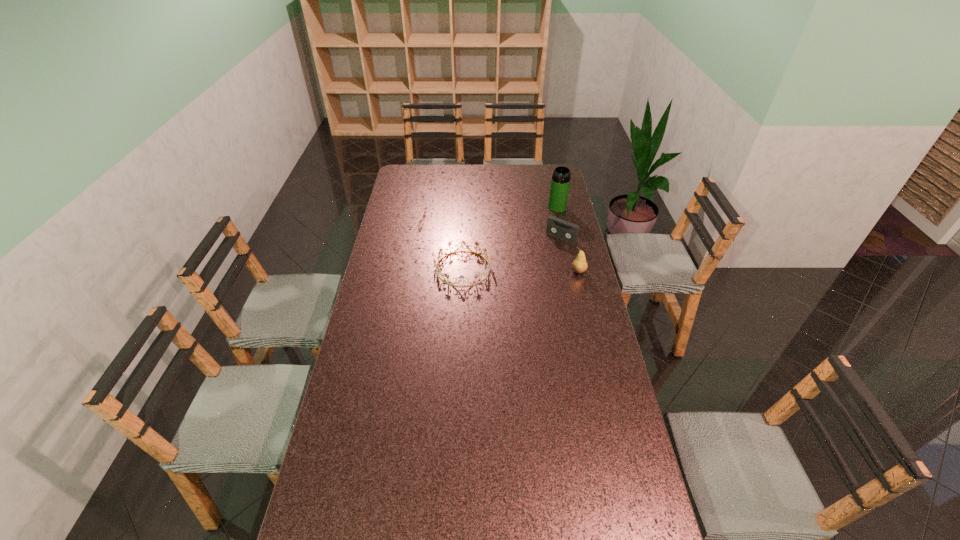
Find the location of a particular element. The height and width of the screenshot is (540, 960). free space at the far left corner of the desktop is located at coordinates (411, 174).

Locate an element on the screen. The image size is (960, 540). free space that is in between the third nearest object and the pear is located at coordinates (570, 254).

Where is `empty space that is in between the pear and the tiara`? Image resolution: width=960 pixels, height=540 pixels. empty space that is in between the pear and the tiara is located at coordinates (521, 270).

Identify the location of vacant area that lies between the tiara and the tallest object. This screenshot has height=540, width=960. (511, 238).

You are a GUI agent. You are given a task and a screenshot of the screen. Output one action in this format:
    pyautogui.click(x=<x>, y=<y>)
    Task: Click on the free space that is in between the second farthest object and the tiara
    Image resolution: width=960 pixels, height=540 pixels.
    Given the screenshot: What is the action you would take?
    pyautogui.click(x=513, y=253)

Where is `free space between the pear and the leftmost object`? The height and width of the screenshot is (540, 960). free space between the pear and the leftmost object is located at coordinates (521, 270).

Locate an element on the screen. This screenshot has width=960, height=540. blank region between the leftmost object and the videotape is located at coordinates [513, 253].

In order to click on free space between the second farthest object and the tiara in this screenshot , I will do `click(513, 253)`.

The width and height of the screenshot is (960, 540). What are the coordinates of `object identified as the closest to the third shortest object` in the screenshot? It's located at [556, 227].

Identify which object is located as the second nearest to the leftmost object. Please provide its 2D coordinates. Your answer should be formatted as a tuple, i.e. [(x, y)], where the tuple contains the x and y coordinates of a point satisfying the conditions above.

[(579, 265)]